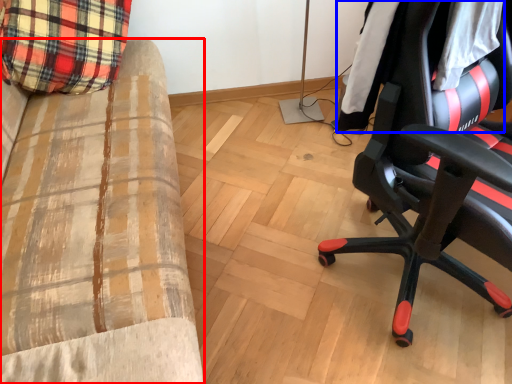
Question: Among these objects, which one is farthest to the camera, furniture (highlighted by a red box) or clothing (highlighted by a blue box)?

Choices:
 (A) furniture
 (B) clothing

Answer: (B)